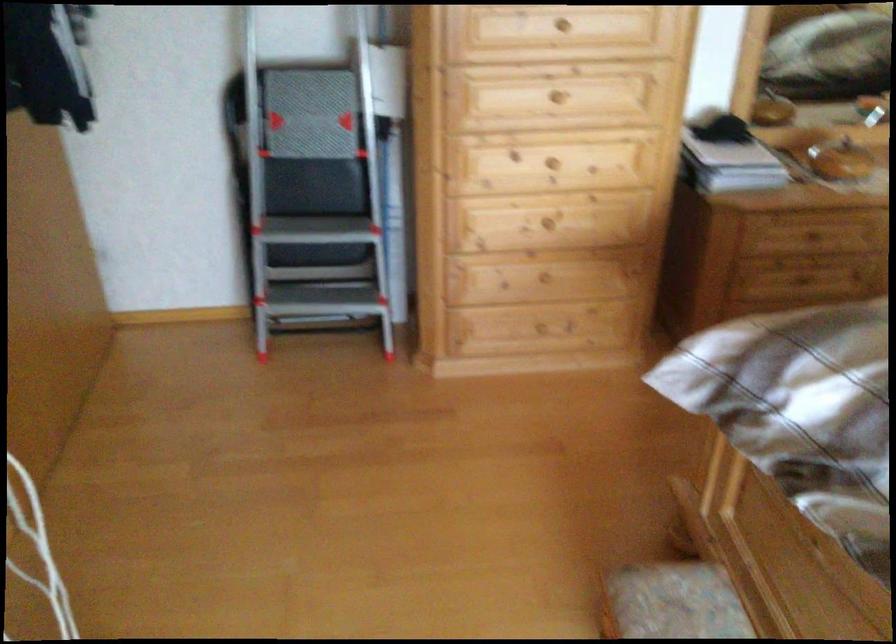
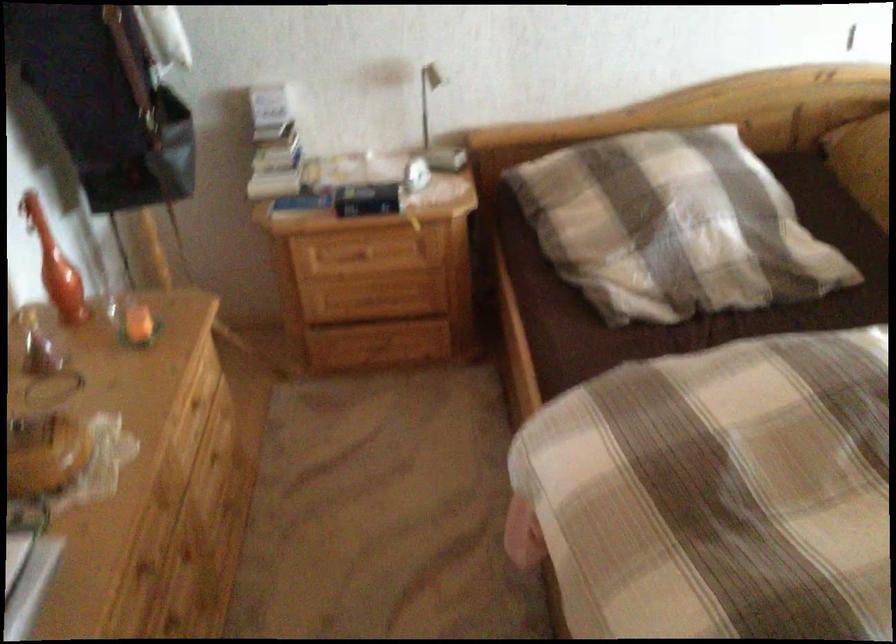
Locate, in the second image, the point that corresponds to (815,225) in the first image.

(144, 565)